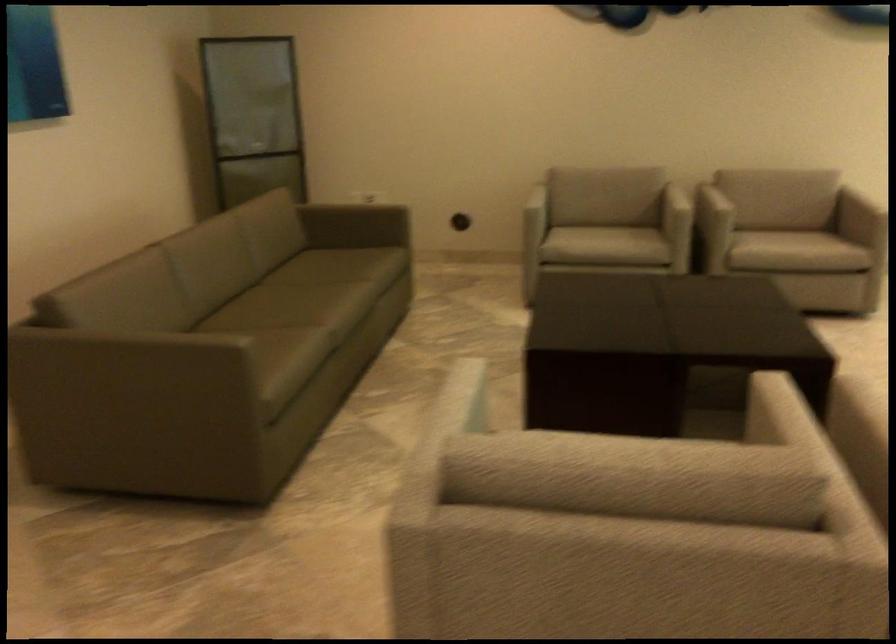
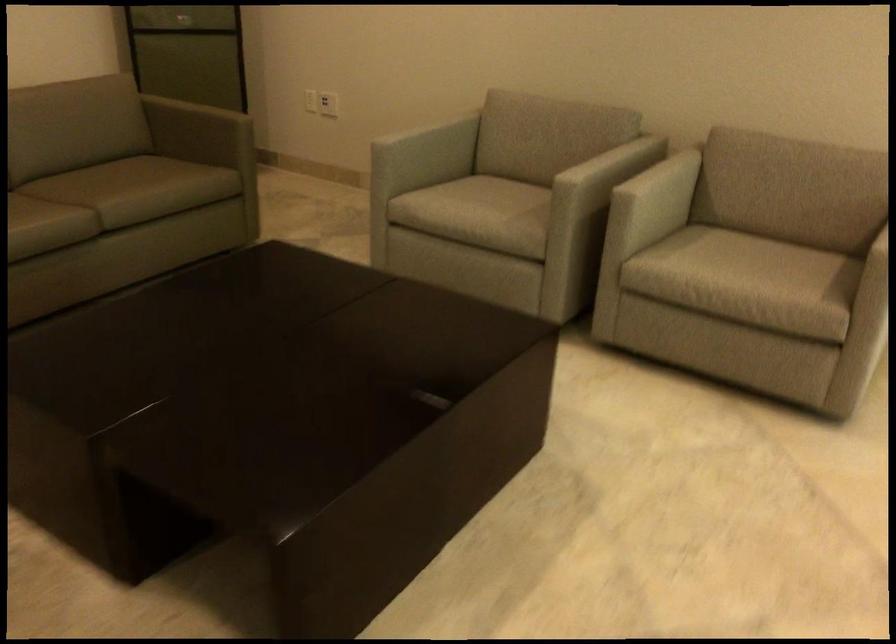
Where in the second image is the point corresponding to pixel 389 257 from the first image?

(145, 187)